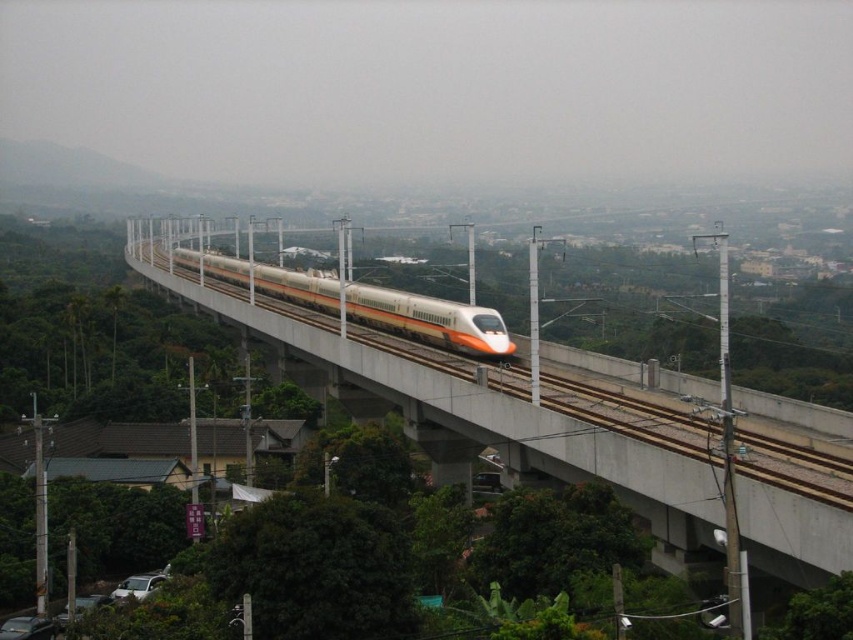
Is white concrete bridge at center taller than white glossy passenger train at center?

Indeed, white concrete bridge at center has a greater height compared to white glossy passenger train at center.

Can you confirm if white concrete bridge at center is thinner than white glossy passenger train at center?

No, white concrete bridge at center is not thinner than white glossy passenger train at center.

This screenshot has height=640, width=853. Describe the element at coordinates (489, 406) in the screenshot. I see `white concrete bridge at center` at that location.

Find the location of a particular element. The width and height of the screenshot is (853, 640). white concrete bridge at center is located at coordinates coord(489,406).

How distant is yellow metallic train track at center from white glossy passenger train at center?

The distance of yellow metallic train track at center from white glossy passenger train at center is 101.53 feet.

Who is lower down, yellow metallic train track at center or white glossy passenger train at center?

Positioned lower is yellow metallic train track at center.

Which is behind, point (618, 387) or point (421, 314)?

Positioned behind is point (421, 314).

The width and height of the screenshot is (853, 640). I want to click on yellow metallic train track at center, so click(x=635, y=416).

Which is below, white concrete bridge at center or yellow metallic train track at center?

Positioned lower is yellow metallic train track at center.

Who is shorter, white concrete bridge at center or yellow metallic train track at center?

With less height is yellow metallic train track at center.

Does point (656, 452) come closer to viewer compared to point (836, 506)?

No, it is not.

Identify the location of white concrete bridge at center. (489, 406).